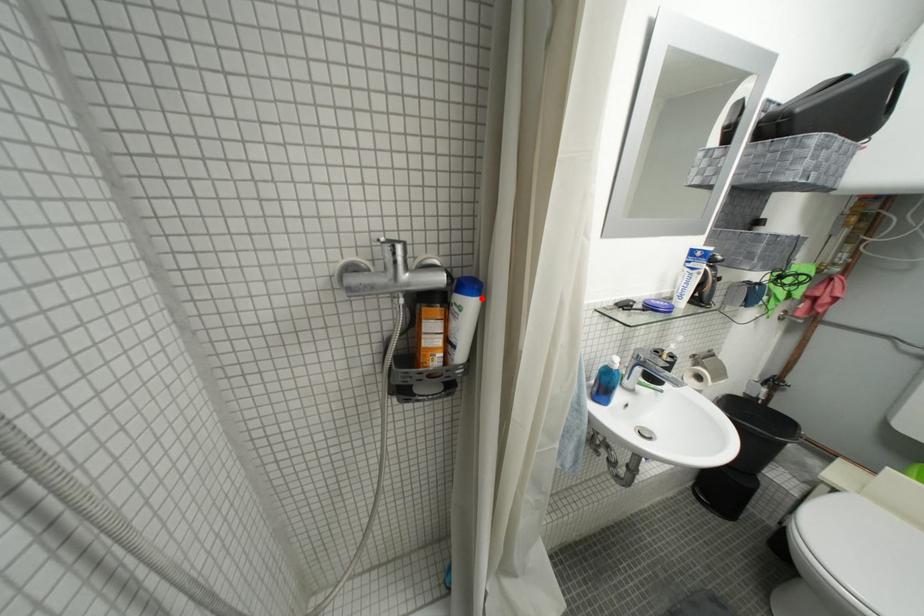
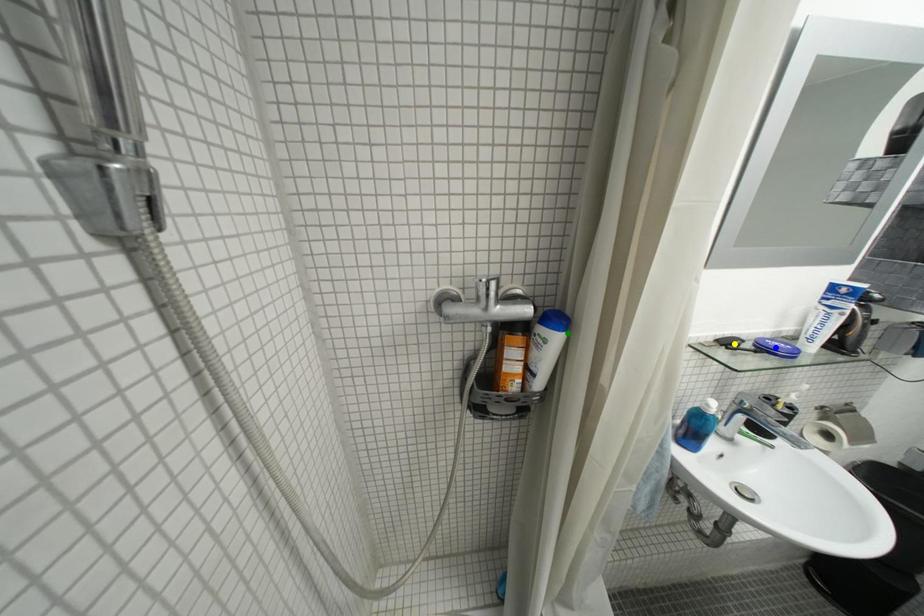
Question: I am providing you with two images of the same scene from different viewpoints. A red point is marked on the first image. You are given multiple points on the second image. In image 2, which mark is for the same physical point as the one in image 1?

Choices:
 (A) green point
 (B) blue point
 (C) yellow point

Answer: (A)